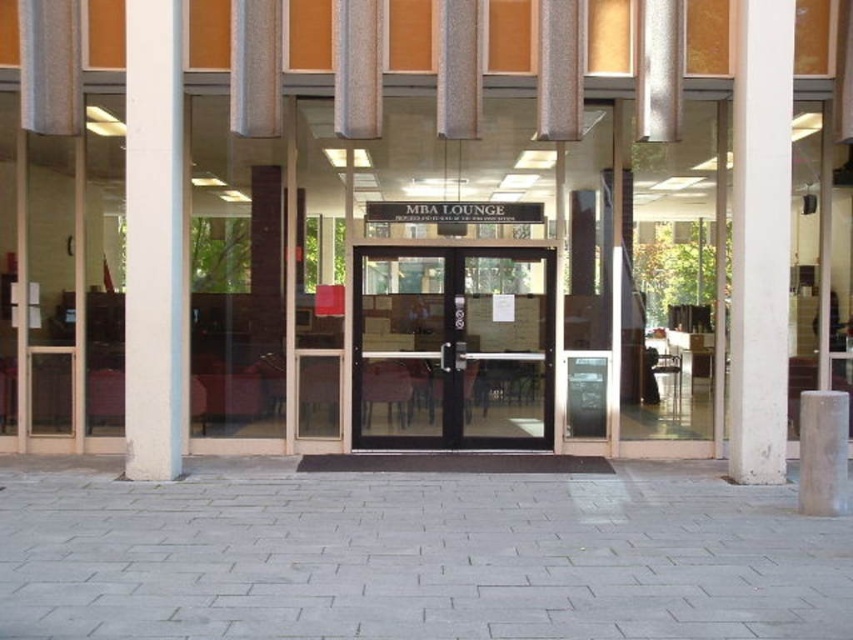
You are a delivery person with a 1.5 meter wide package. You need to enter the MBA Lounge through the entrance shown. Can the transparent glass door at center accommodate your package? Please consider the white concrete pillar at right in your answer.

The transparent glass door at center is wider than the white concrete pillar at right. Since the package is 1.5 meters wide, if the door is wider than this measurement, it can accommodate the package. However, without exact dimensions, we can infer that since the door surpasses the pillar in width, it might be sufficient. Please verify on site.